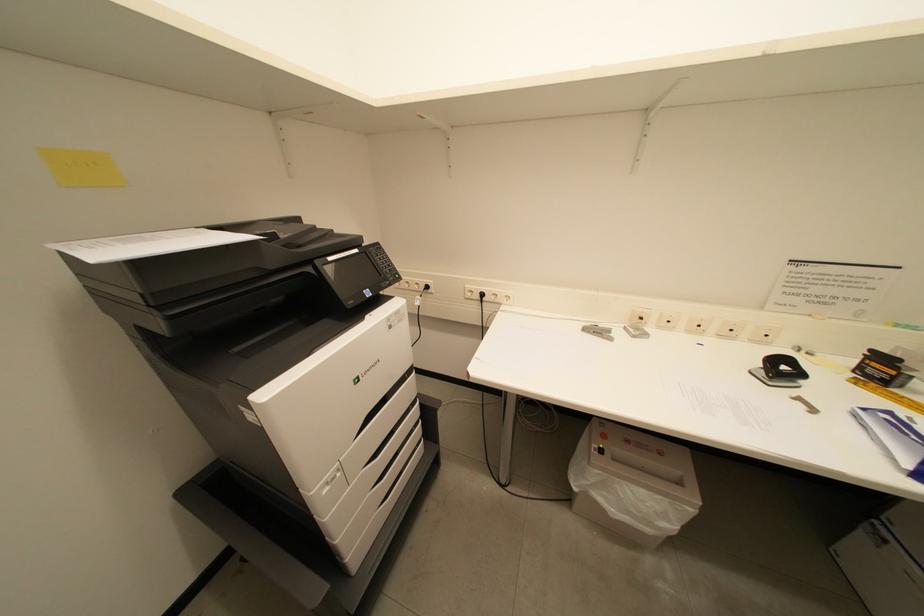
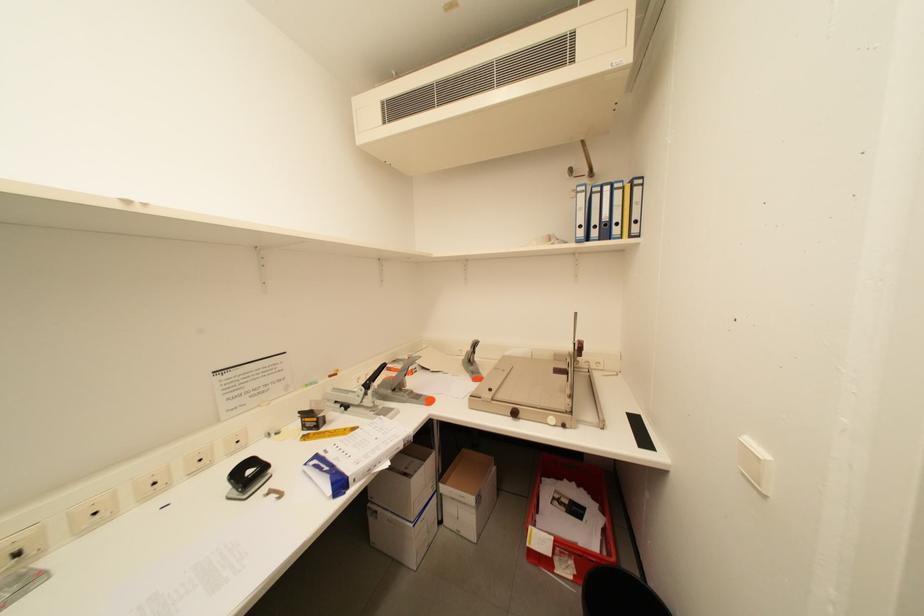
Question: How did the camera likely rotate?

Choices:
 (A) Left
 (B) Right
 (C) Up
 (D) Down

Answer: (B)